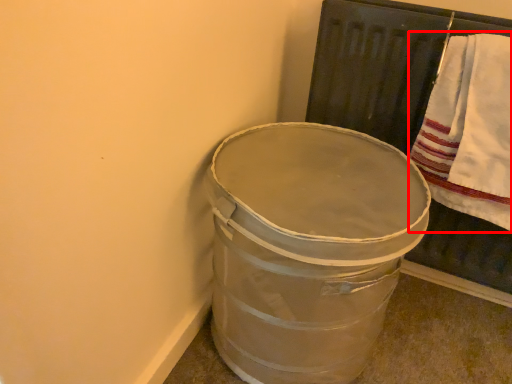
Question: From the image's perspective, considering the relative positions of bath towel (annotated by the red box) and waste container in the image provided, where is bath towel (annotated by the red box) located with respect to the staircase?

Choices:
 (A) below
 (B) above

Answer: (B)